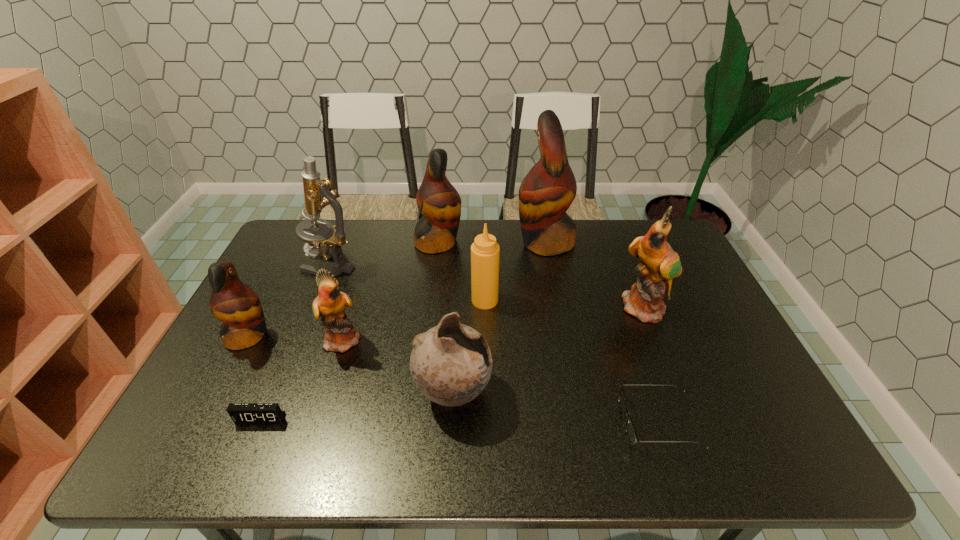
In order to click on vacant point located 0.150m on the front-facing side of the bigger green parrot in this screenshot , I will do `click(670, 369)`.

Find the location of a particular element. This screenshot has height=540, width=960. free location located 0.340m on the left of the condiment is located at coordinates (359, 300).

The width and height of the screenshot is (960, 540). In order to click on vacant space located on the front-facing side of the fourth parrot from right to left in this screenshot , I will do `click(491, 339)`.

You are a GUI agent. You are given a task and a screenshot of the screen. Output one action in this format:
    pyautogui.click(x=<x>, y=<y>)
    Task: Click on the vacant area situated on the face of the smallest red parrot
    The width and height of the screenshot is (960, 540).
    Given the screenshot: What is the action you would take?
    pyautogui.click(x=379, y=336)

The height and width of the screenshot is (540, 960). Find the location of `vacant point located 0.050m from the spout of the pottery`. vacant point located 0.050m from the spout of the pottery is located at coordinates (513, 392).

Find the location of a particular element. Image resolution: width=960 pixels, height=540 pixels. vacant space located on the front-facing side of the alarm clock is located at coordinates (244, 457).

I want to click on vacant space situated through the lenses of the black spectacles, so click(x=544, y=422).

Locate an element on the screen. blank space located through the lenses of the black spectacles is located at coordinates (497, 422).

Image resolution: width=960 pixels, height=540 pixels. I want to click on free space located 0.360m through the lenses of the black spectacles, so click(468, 422).

Where is `microscope at the far edge`? The height and width of the screenshot is (540, 960). microscope at the far edge is located at coordinates [x=317, y=195].